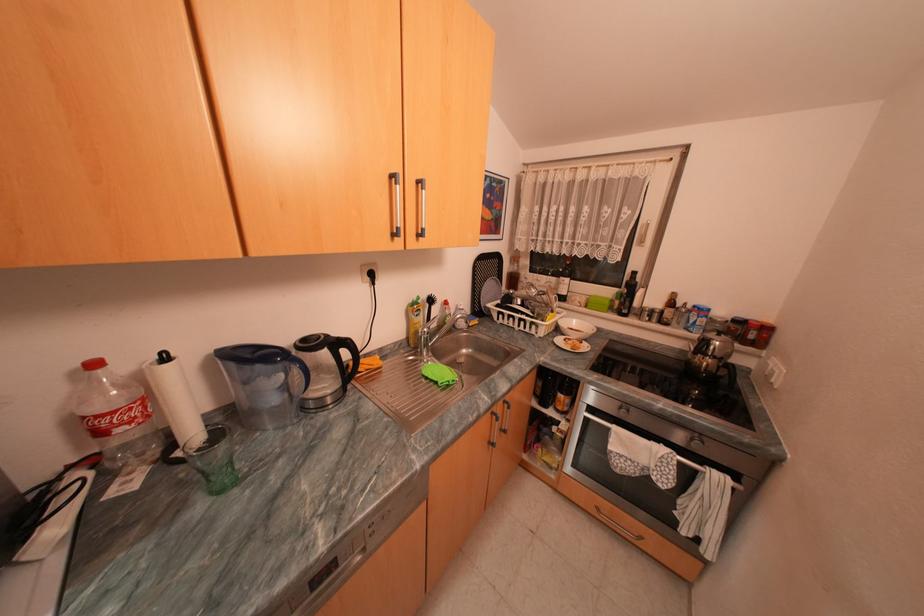
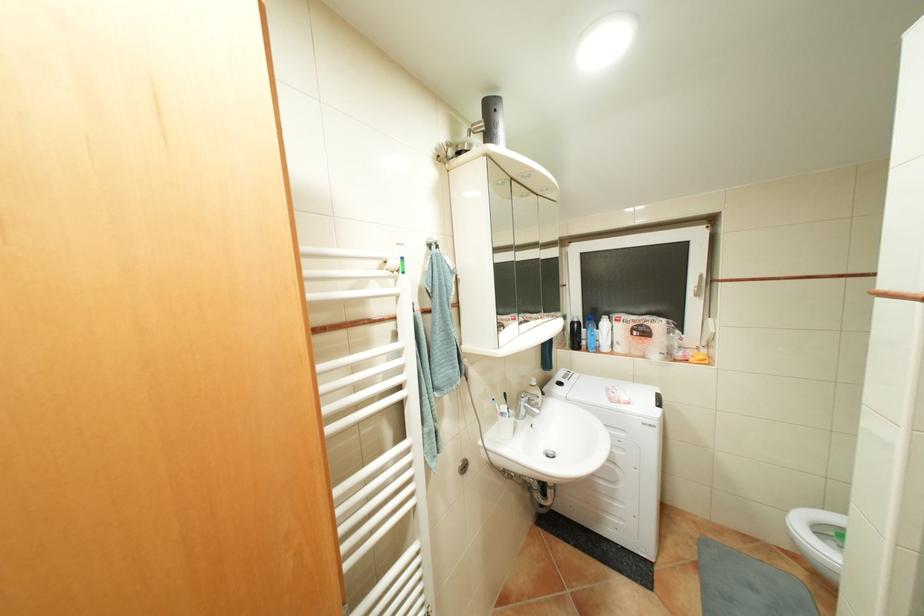
Which direction would the cameraman need to move to produce the second image?

The cameraman moved toward left, forward.